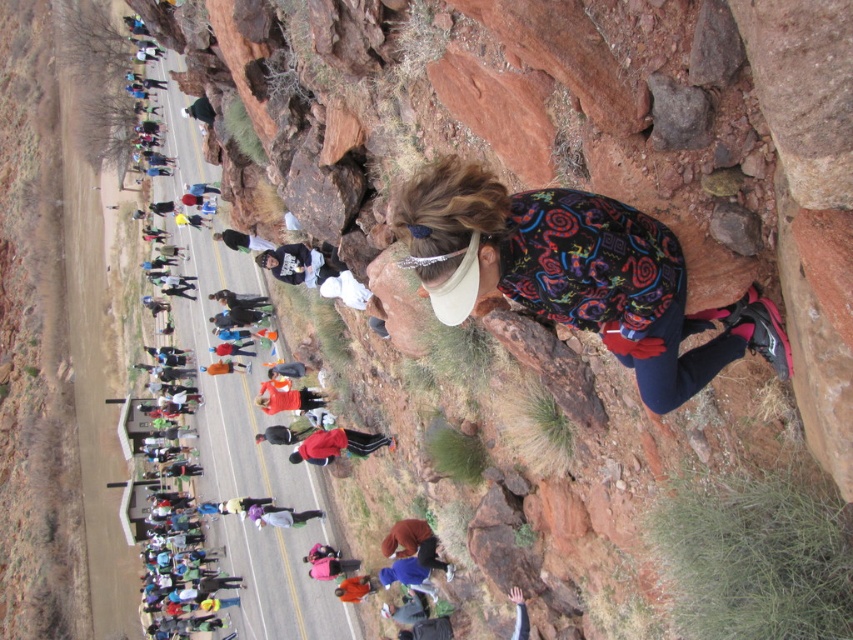
Question: Which of the following is the farthest from the observer?

Choices:
 (A) smooth dirt road at center
 (B) multicolored fabric at upper right

Answer: (A)

Question: Does multicolored fabric at upper right have a smaller size compared to smooth dirt road at center?

Choices:
 (A) no
 (B) yes

Answer: (B)

Question: Does multicolored fabric at upper right come behind smooth dirt road at center?

Choices:
 (A) no
 (B) yes

Answer: (A)

Question: Does multicolored fabric at upper right have a greater width compared to smooth dirt road at center?

Choices:
 (A) no
 (B) yes

Answer: (A)

Question: Which object is farther from the camera taking this photo?

Choices:
 (A) multicolored fabric at upper right
 (B) smooth dirt road at center

Answer: (B)

Question: Which point is closer to the camera?

Choices:
 (A) (503, 243)
 (B) (279, 584)

Answer: (A)